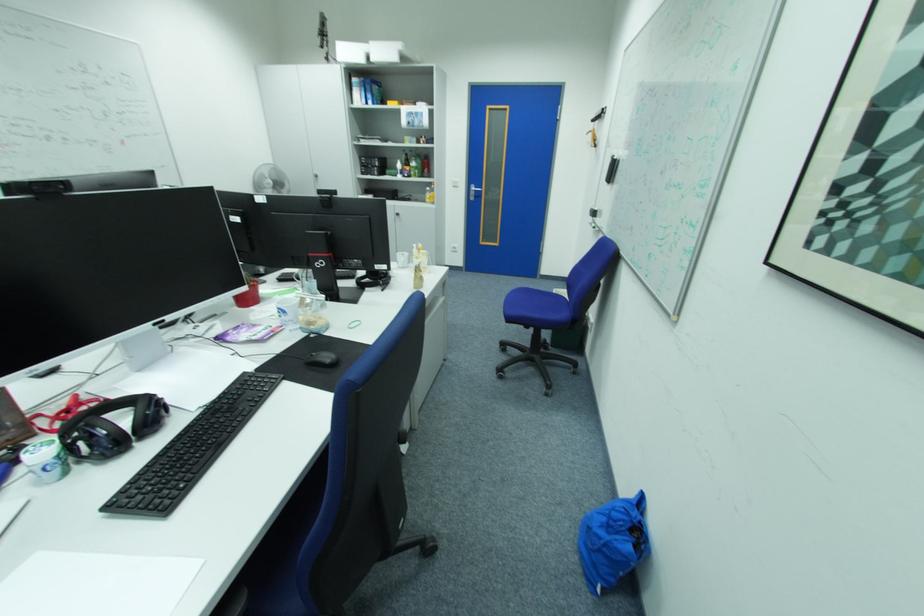
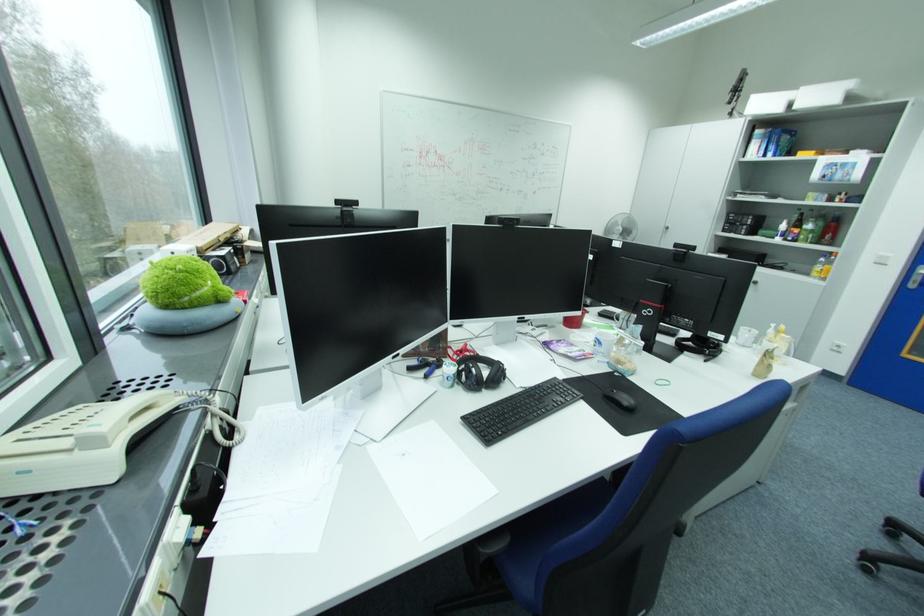
Where in the second image is the point corresponding to the point at 407,216 from the first image?

(763, 283)